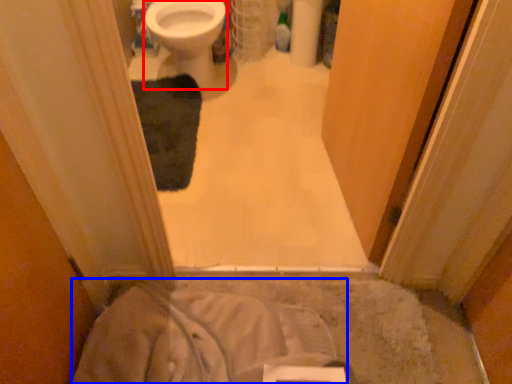
Question: Which object is closer to the camera taking this photo, bidet (highlighted by a red box) or sheet (highlighted by a blue box)?

Choices:
 (A) bidet
 (B) sheet

Answer: (B)